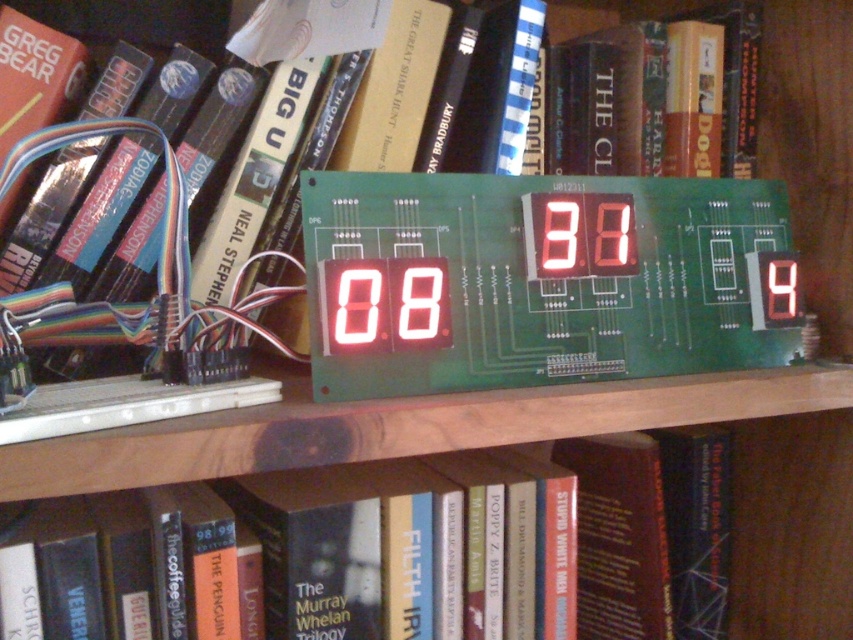
Question: Which point is farther to the camera?

Choices:
 (A) (727, 195)
 (B) (537, 472)

Answer: (A)

Question: From the image, what is the correct spatial relationship of hardcover book at center in relation to white led display at center?

Choices:
 (A) below
 (B) above

Answer: (A)

Question: Can you confirm if hardcover book at center is smaller than white led display at center?

Choices:
 (A) no
 (B) yes

Answer: (A)

Question: Observing the image, what is the correct spatial positioning of hardcover book at center in reference to white led display at center?

Choices:
 (A) right
 (B) left

Answer: (B)